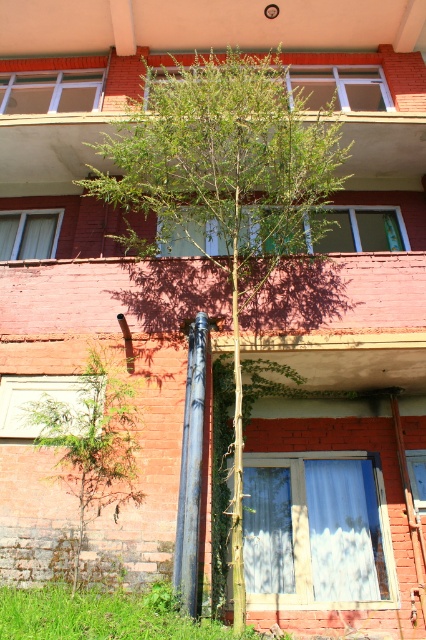
Is point (187, 182) less distant than point (196, 371)?

No, it is not.

Between green leafy tree at center and rusty metal pipe at center, which one has less height?

With less height is rusty metal pipe at center.

What are the coordinates of `green leafy tree at center` in the screenshot? It's located at (224, 188).

Does green leafy tree at center have a lesser width compared to green leafy tree at lower left?

No.

Can you confirm if green leafy tree at center is positioned below green leafy tree at lower left?

No, green leafy tree at center is not below green leafy tree at lower left.

Locate an element on the screen. Image resolution: width=426 pixels, height=640 pixels. green leafy tree at center is located at coordinates click(224, 188).

The image size is (426, 640). What are the coordinates of `green leafy tree at lower left` in the screenshot? It's located at (92, 444).

Can you confirm if green leafy tree at lower left is positioned above rusty metal pipe at center?

No, green leafy tree at lower left is not above rusty metal pipe at center.

This screenshot has height=640, width=426. Describe the element at coordinates (92, 444) in the screenshot. I see `green leafy tree at lower left` at that location.

Image resolution: width=426 pixels, height=640 pixels. I want to click on green leafy tree at lower left, so click(92, 444).